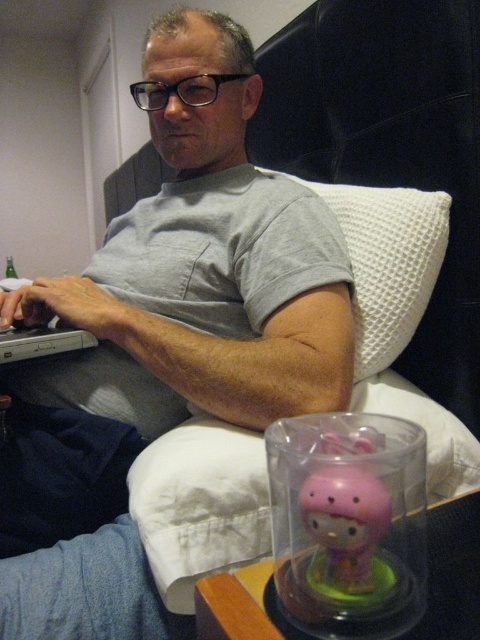
Is gray cotton shirt at upper center smaller than white waffle-textured pillow at upper right?

No.

Locate an element on the screen. Image resolution: width=480 pixels, height=640 pixels. gray cotton shirt at upper center is located at coordinates (204, 262).

I want to click on gray cotton shirt at upper center, so click(x=204, y=262).

Is point (60, 630) more distant than point (419, 508)?

Yes, point (60, 630) is farther from viewer.

Which of these two, gray cotton shirt at upper center or pink plastic piggy bank at lower right, stands taller?

gray cotton shirt at upper center

Which is behind, point (345, 298) or point (403, 627)?

Positioned behind is point (345, 298).

At what (x,y) coordinates should I click in order to perform the action: click on gray cotton shirt at upper center. Please return your answer as a coordinate pair (x, y). The image size is (480, 640). Looking at the image, I should click on tap(204, 262).

Is pink plastic piggy bank at lower right smaller than white waffle-textured pillow at upper right?

Yes, pink plastic piggy bank at lower right is smaller than white waffle-textured pillow at upper right.

Is pink plastic piggy bank at lower right positioned before white waffle-textured pillow at upper right?

Yes, it is.

Is point (379, 611) less distant than point (391, 192)?

Yes, point (379, 611) is closer to viewer.

The width and height of the screenshot is (480, 640). Identify the location of pink plastic piggy bank at lower right. (348, 524).